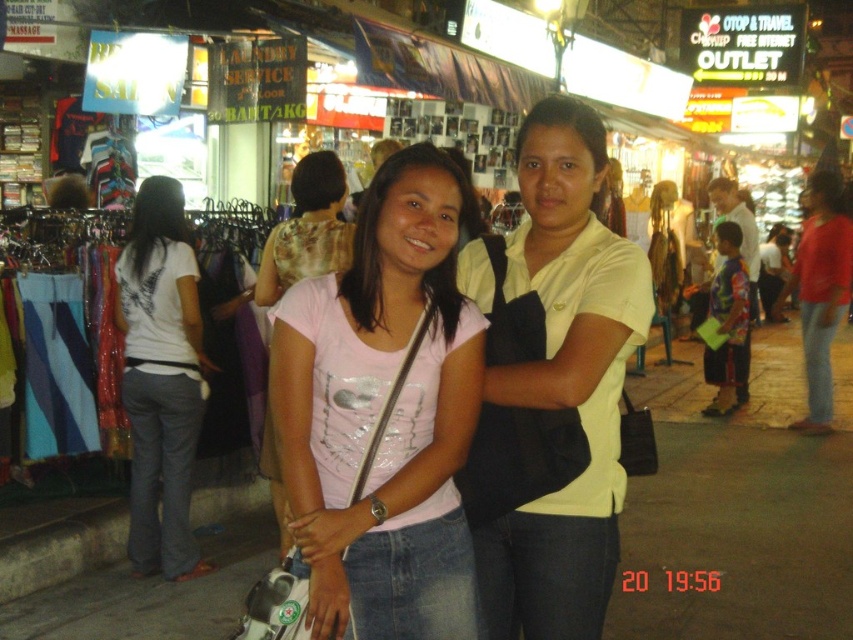
You are a photographer standing in the market and see both the matte pink shirt at center and the pink fabric shirt at center. Which one is positioned lower in the image?

The matte pink shirt at center is located below the pink fabric shirt at center, so it is positioned lower in the image.

You are standing at the point marked as point (x=160, y=193) in the image and want to walk to the nearest shop entrance. The nearest shop entrance is located 5 meters away from your current position. Can you reach it without walking more than 5 meters?

The distance between point (x=160, y=193) and the viewer is 4.93 meters, so yes, you can reach the nearest shop entrance within 5 meters since the distance is slightly less than the maximum allowed.